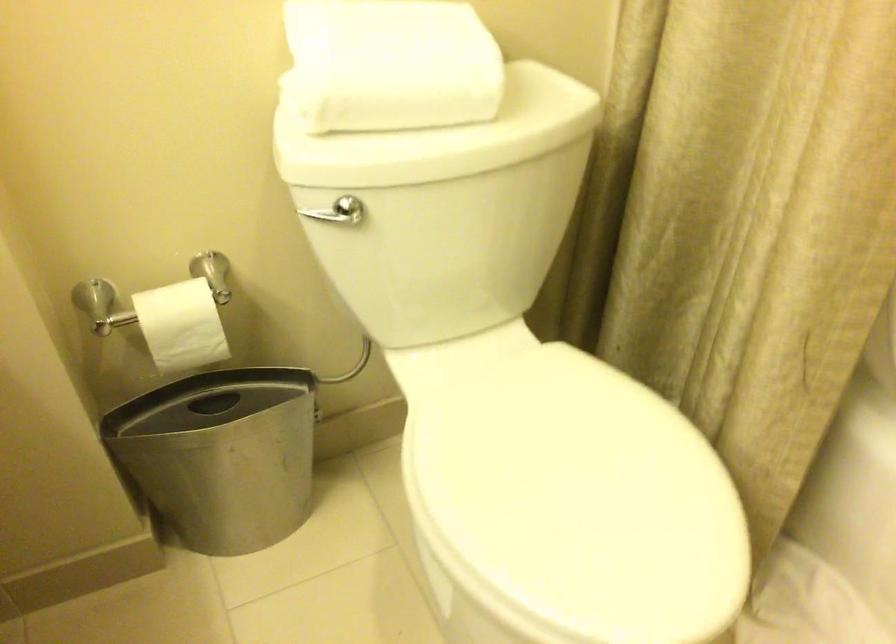
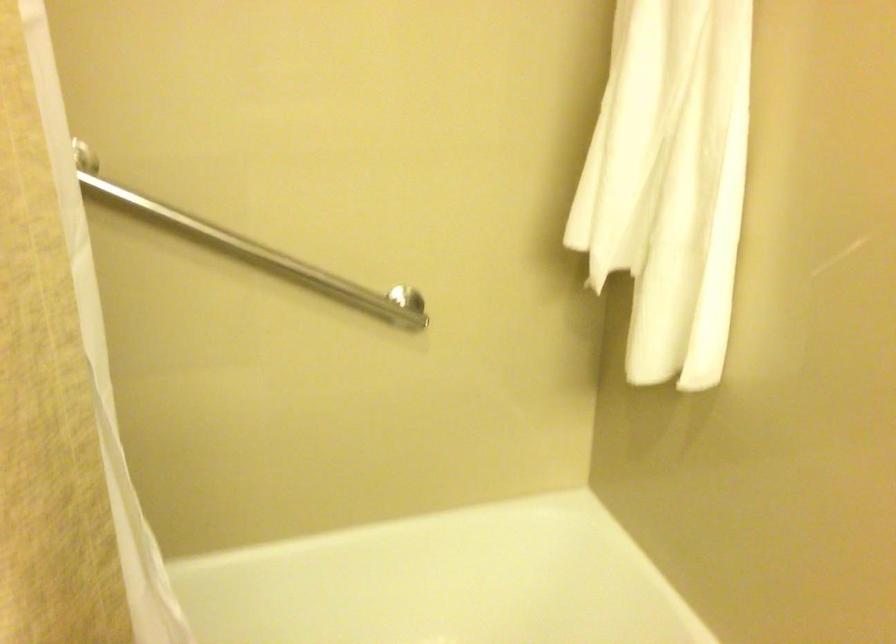
Question: The first image is from the beginning of the video and the second image is from the end. How did the camera likely rotate when shooting the video?

Choices:
 (A) Left
 (B) Right
 (C) Up
 (D) Down

Answer: (B)